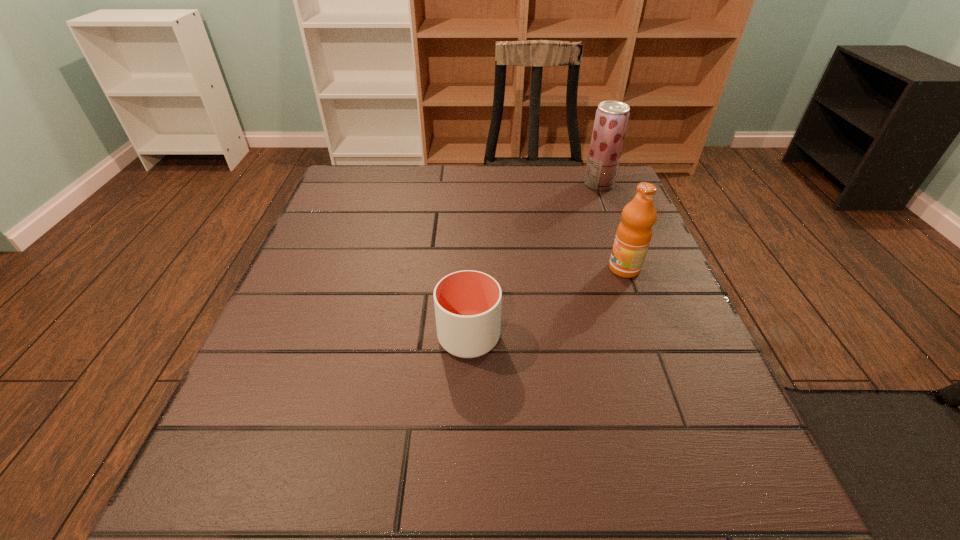
I want to click on object located in the far right corner section of the desktop, so click(611, 118).

You are a GUI agent. You are given a task and a screenshot of the screen. Output one action in this format:
    pyautogui.click(x=<x>, y=<y>)
    Task: Click on the blank area at the far edge
    Image resolution: width=960 pixels, height=540 pixels.
    Given the screenshot: What is the action you would take?
    pyautogui.click(x=547, y=183)

I want to click on vacant region at the left edge of the desktop, so click(345, 221).

Locate an element on the screen. The height and width of the screenshot is (540, 960). vacant space at the right edge is located at coordinates coord(650,382).

In the image, there is a desktop. At what (x,y) coordinates should I click in order to perform the action: click on vacant area at the far left corner. Please return your answer as a coordinate pair (x, y). Looking at the image, I should click on (367, 177).

In the image, there is a desktop. What are the coordinates of `vacant space at the far right corner` in the screenshot? It's located at (570, 191).

I want to click on vacant region at the near right corner of the desktop, so click(x=700, y=507).

Locate an element on the screen. The image size is (960, 540). vacant space in between the farthest object and the cup is located at coordinates (534, 261).

I want to click on vacant point located between the shortest object and the farther fruit juice, so click(534, 261).

Locate an element on the screen. Image resolution: width=960 pixels, height=540 pixels. vacant space in between the cup and the nearer fruit juice is located at coordinates (546, 303).